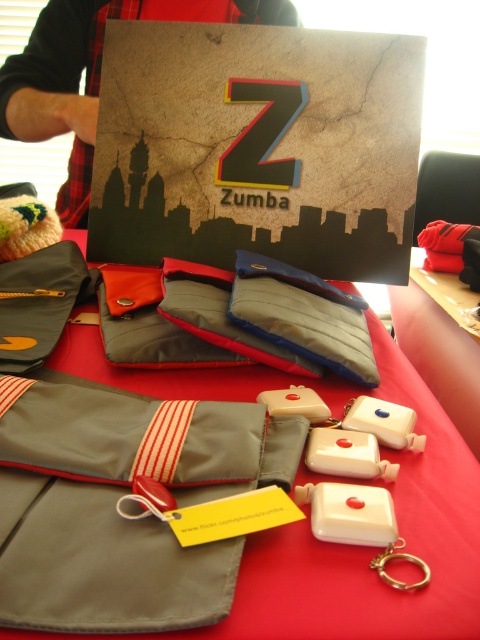
Question: Is gray fabric pouch at center positioned behind red plaid shirt at upper left?

Choices:
 (A) yes
 (B) no

Answer: (B)

Question: Based on their relative distances, which object is nearer to the gray fabric pouch at center?

Choices:
 (A) red fabric tablecloth at center
 (B) red plaid shirt at upper left

Answer: (A)

Question: Which point is farther to the camera?

Choices:
 (A) red fabric tablecloth at center
 (B) gray fabric pouch at center
 (C) red plaid shirt at upper left

Answer: (C)

Question: Estimate the real-world distances between objects in this image. Which object is farther from the gray fabric pouch at center?

Choices:
 (A) red plaid shirt at upper left
 (B) red fabric tablecloth at center

Answer: (A)

Question: Is gray fabric pouch at center above red plaid shirt at upper left?

Choices:
 (A) no
 (B) yes

Answer: (A)

Question: Is red fabric tablecloth at center wider than red plaid shirt at upper left?

Choices:
 (A) no
 (B) yes

Answer: (A)